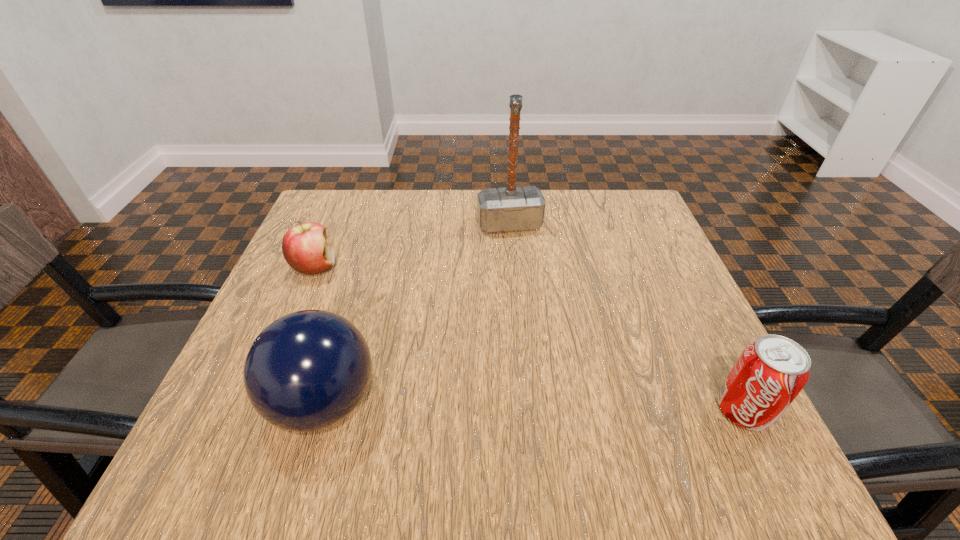
Where is `object that is positioned at the right edge`? object that is positioned at the right edge is located at coordinates click(x=769, y=374).

In order to click on object present at the near left corner in this screenshot , I will do `click(308, 370)`.

The image size is (960, 540). I want to click on object located at the near right corner, so click(x=769, y=374).

I want to click on free space at the far edge of the desktop, so click(403, 216).

In the image, there is a desktop. Identify the location of vacant area at the near edge. (491, 414).

Locate an element on the screen. The image size is (960, 540). free point at the left edge is located at coordinates pyautogui.click(x=335, y=298).

Locate an element on the screen. This screenshot has height=540, width=960. vacant space at the right edge of the desktop is located at coordinates (653, 245).

I want to click on free space at the far left corner, so click(360, 224).

You are a GUI agent. You are given a task and a screenshot of the screen. Output one action in this format:
    pyautogui.click(x=<x>, y=<y>)
    Task: Click on the free region at the far right corner of the desktop
    The image size is (960, 540).
    Given the screenshot: What is the action you would take?
    pyautogui.click(x=599, y=205)

I want to click on vacant space at the near right corner of the desktop, so click(x=667, y=421).